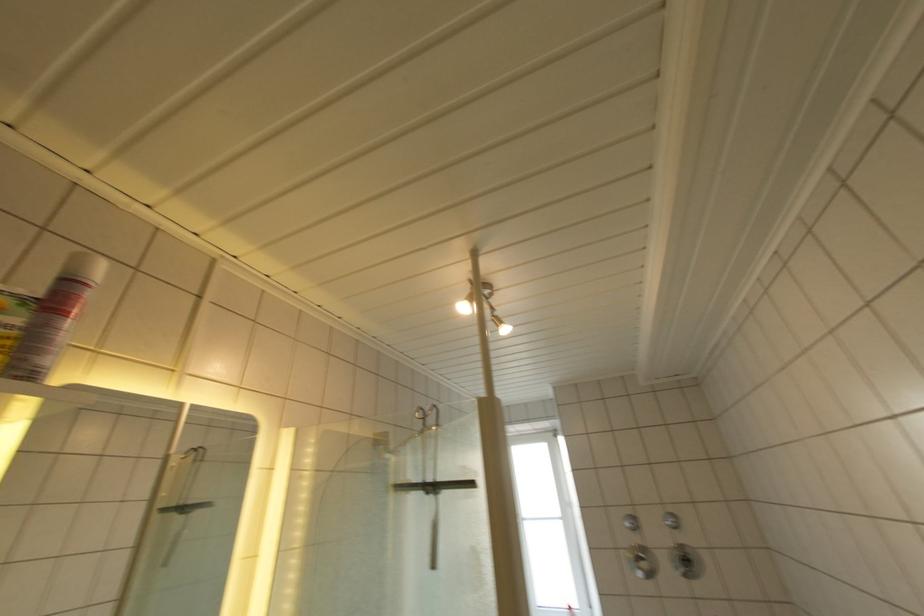
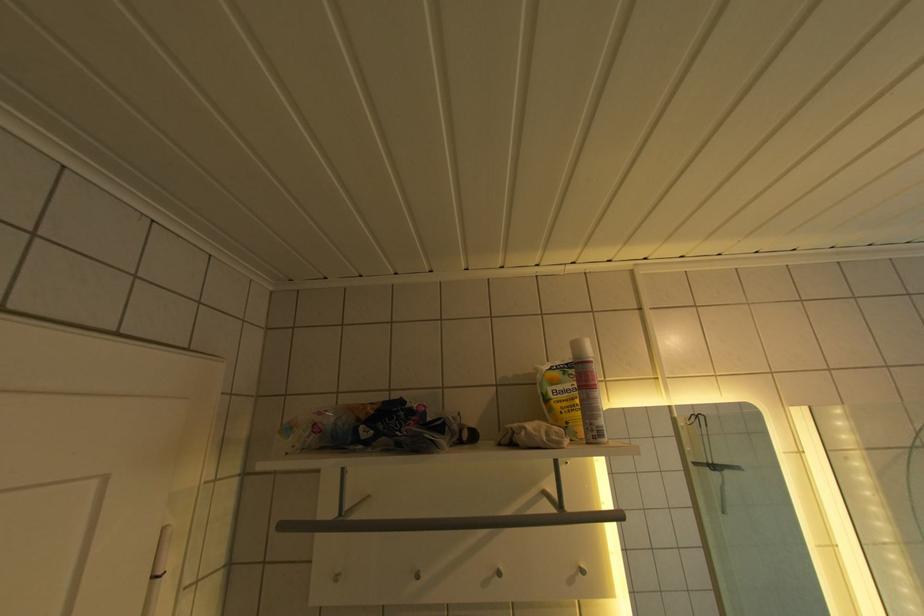
Question: The camera is either moving clockwise (left) or counter-clockwise (right) around the object. The first image is from the beginning of the video and the second image is from the end. Is the camera moving left or right when shooting the video?

Choices:
 (A) Left
 (B) Right

Answer: (B)